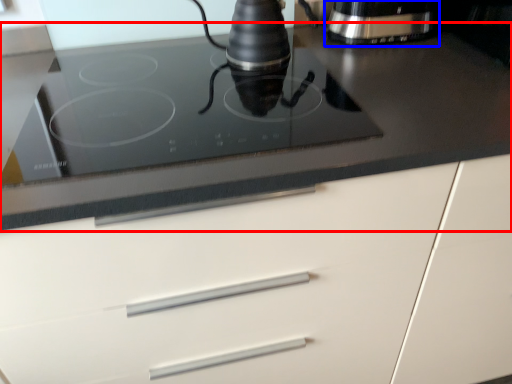
Question: Which of the following is the farthest to the observer, countertop (highlighted by a red box) or home appliance (highlighted by a blue box)?

Choices:
 (A) countertop
 (B) home appliance

Answer: (B)